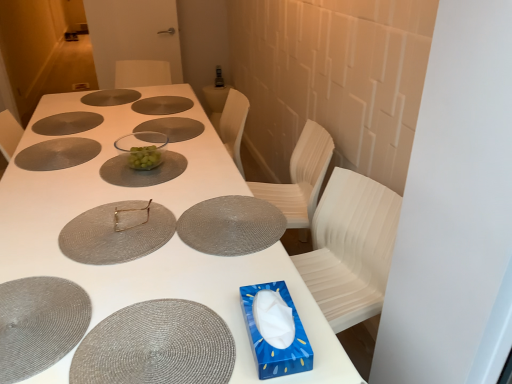
At what (x,y) coordinates should I click in order to perform the action: click on unoccupied area behind transparent glass bowl at center. Please return your answer as a coordinate pair (x, y). The image size is (512, 384). Looking at the image, I should click on (141, 142).